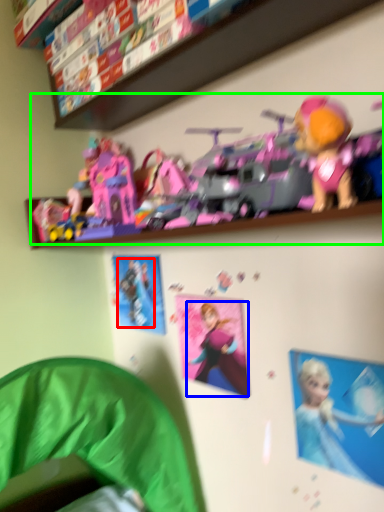
Question: Which object is positioned closest to person (highlighted by a red box)? Select from toy (highlighted by a blue box) and toy (highlighted by a green box).

Choices:
 (A) toy
 (B) toy

Answer: (A)